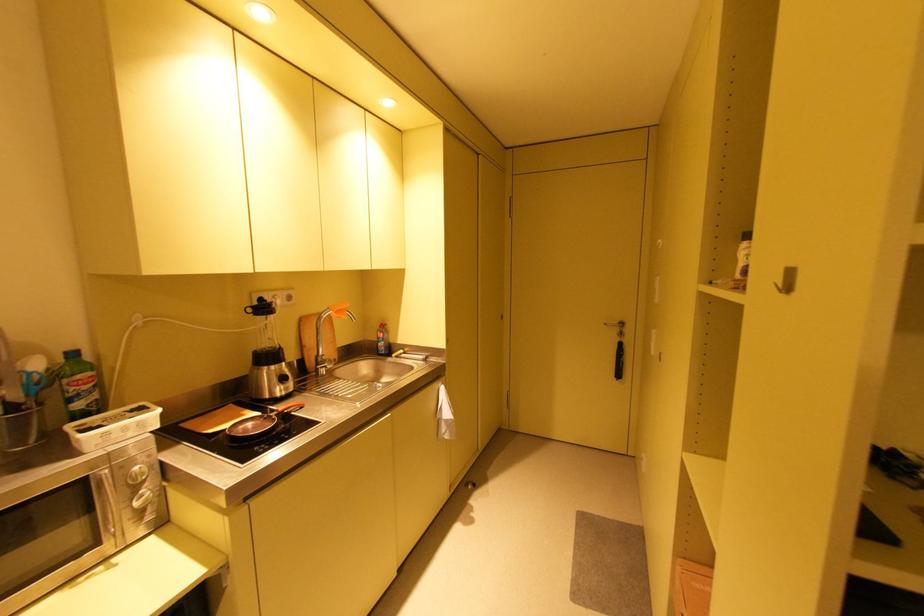
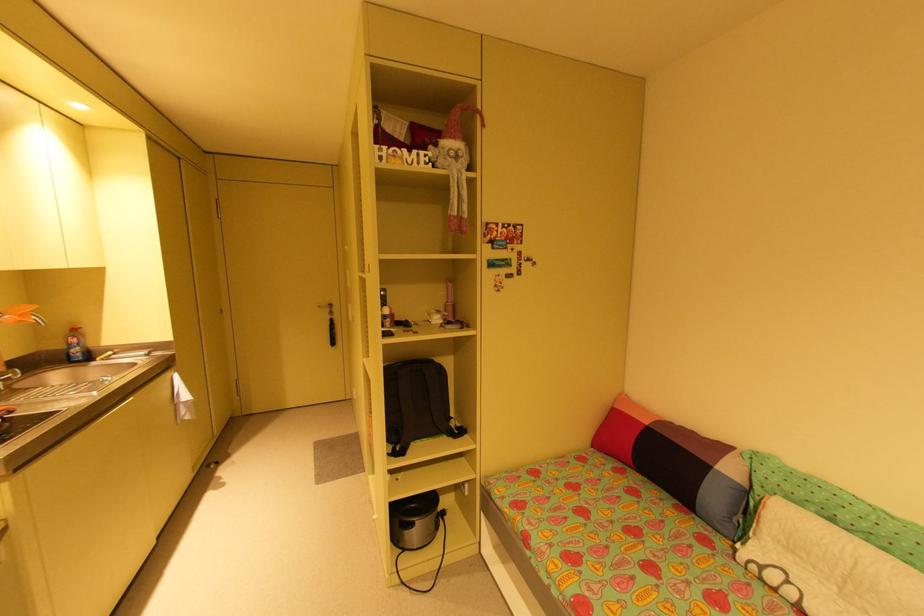
Question: The camera is either moving clockwise (left) or counter-clockwise (right) around the object. The first image is from the beginning of the video and the second image is from the end. Is the camera moving left or right when shooting the video?

Choices:
 (A) Left
 (B) Right

Answer: (A)